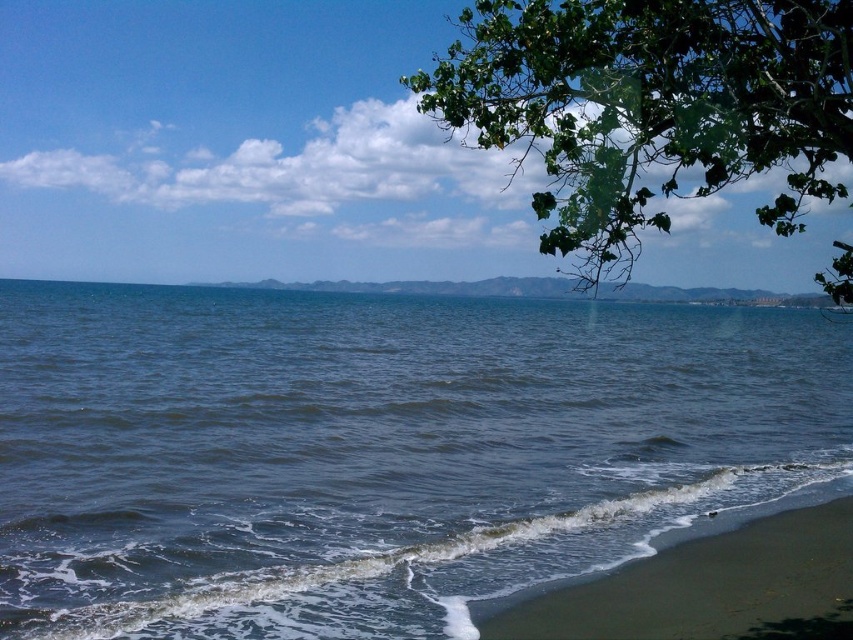
In the scene shown: Between green leafy tree at upper right and dark brown sand at lower right, which one is positioned lower?

Positioned lower is dark brown sand at lower right.

Between green leafy tree at upper right and dark brown sand at lower right, which one appears on the left side from the viewer's perspective?

dark brown sand at lower right

At what (x,y) coordinates should I click in order to perform the action: click on green leafy tree at upper right. Please return your answer as a coordinate pair (x, y). The height and width of the screenshot is (640, 853). Looking at the image, I should click on (650, 106).

This screenshot has width=853, height=640. What are the coordinates of `green leafy tree at upper right` in the screenshot? It's located at (650, 106).

Does point (598, 362) come closer to viewer compared to point (549, 637)?

No, it is behind (549, 637).

Who is taller, dark blue water at lower center or dark brown sand at lower right?

dark blue water at lower center is taller.

This screenshot has width=853, height=640. Identify the location of dark blue water at lower center. (379, 451).

Does dark blue water at lower center appear under green leafy tree at upper right?

Yes.

Which is behind, point (556, 324) or point (543, 29)?

Point (556, 324)

What do you see at coordinates (379, 451) in the screenshot?
I see `dark blue water at lower center` at bounding box center [379, 451].

Where is `dark blue water at lower center`? Image resolution: width=853 pixels, height=640 pixels. dark blue water at lower center is located at coordinates (379, 451).